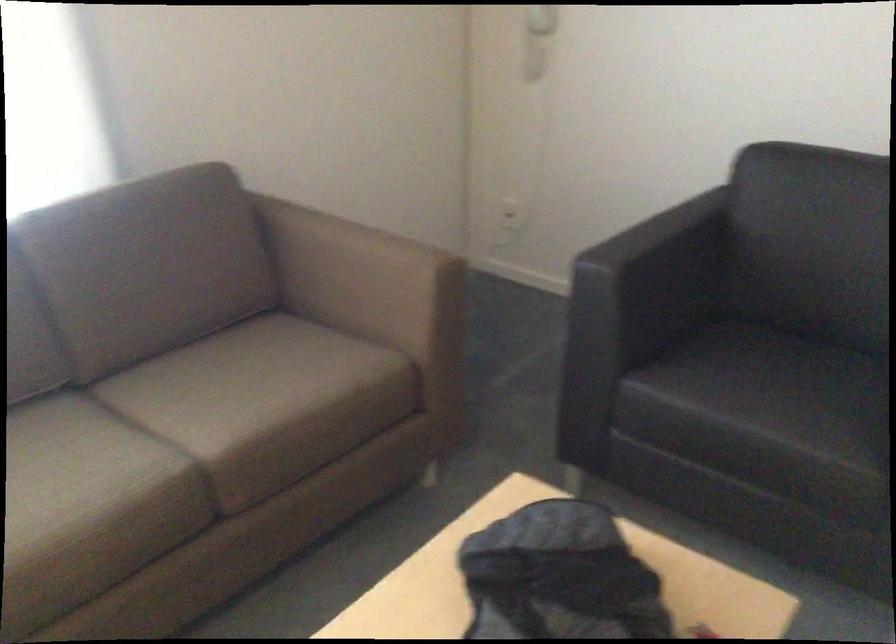
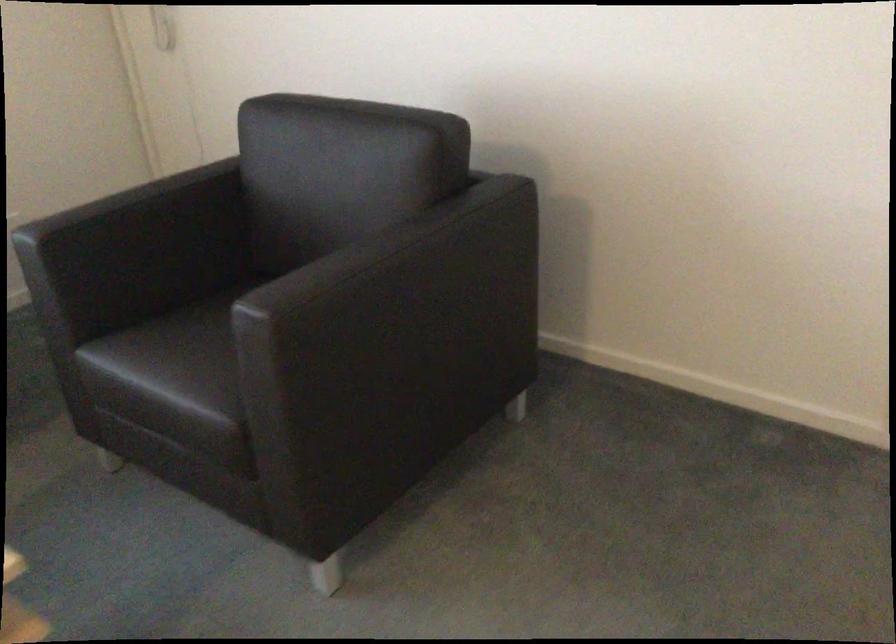
Find the pixel in the second image that matches the point at 756,404 in the first image.

(168, 366)